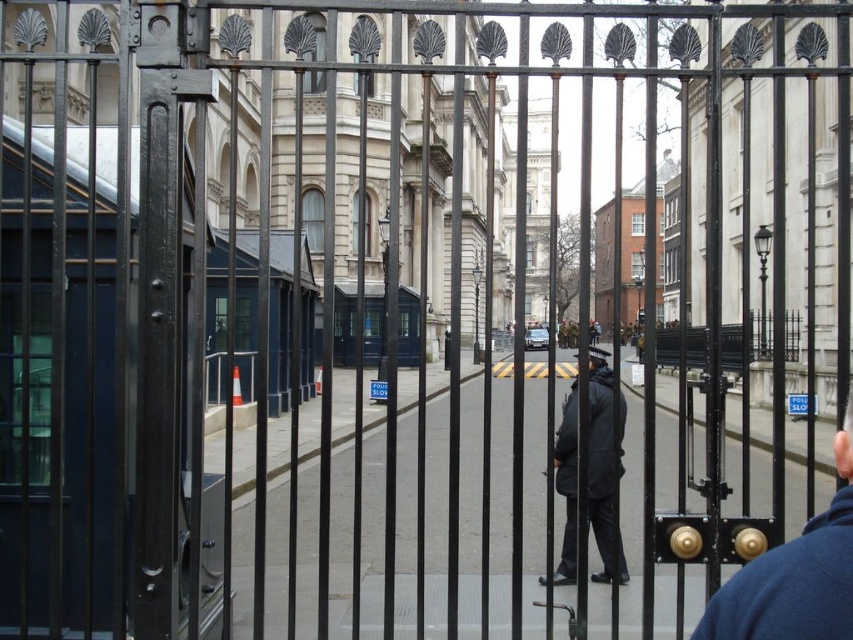
You are a security guard at the entrance and need to determine which jacket is narrower between the blue fleece jacket at right and the dark gray fabric jacket at center. Based on the scene, which one is narrower?

The blue fleece jacket at right is narrower than the dark gray fabric jacket at center.

You are a security guard at the entrance. You need to determine which jacket is shorter between the blue fleece jacket at right and the dark gray fabric jacket at center. Which one should you report?

The blue fleece jacket at right has a lesser height compared to the dark gray fabric jacket at center, so you should report that the blue fleece jacket at right is shorter.

Looking at this image, you are a security guard at the entrance. You need to check the jackets of two visitors. The blue fleece jacket at right and the dark gray fabric jacket at center. Which jacket should you check first if you want to start with the smaller one?

The blue fleece jacket at right has a smaller size compared to the dark gray fabric jacket at center, so you should check the blue fleece jacket at right first.